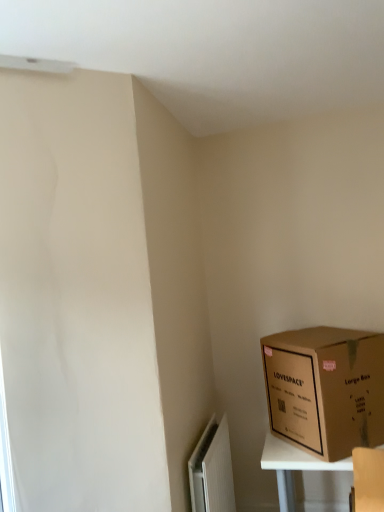
Identify the location of free space above brown cardboard box at lower right (from a real-world perspective). This screenshot has height=512, width=384. (322, 336).